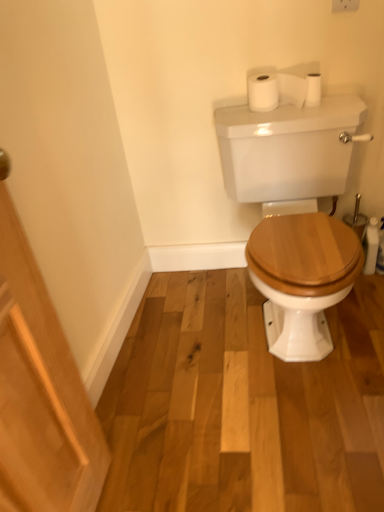
The height and width of the screenshot is (512, 384). I want to click on vacant region to the left of white matte toilet paper at upper center, which is counted as the second toilet paper, starting from the right, so click(x=237, y=117).